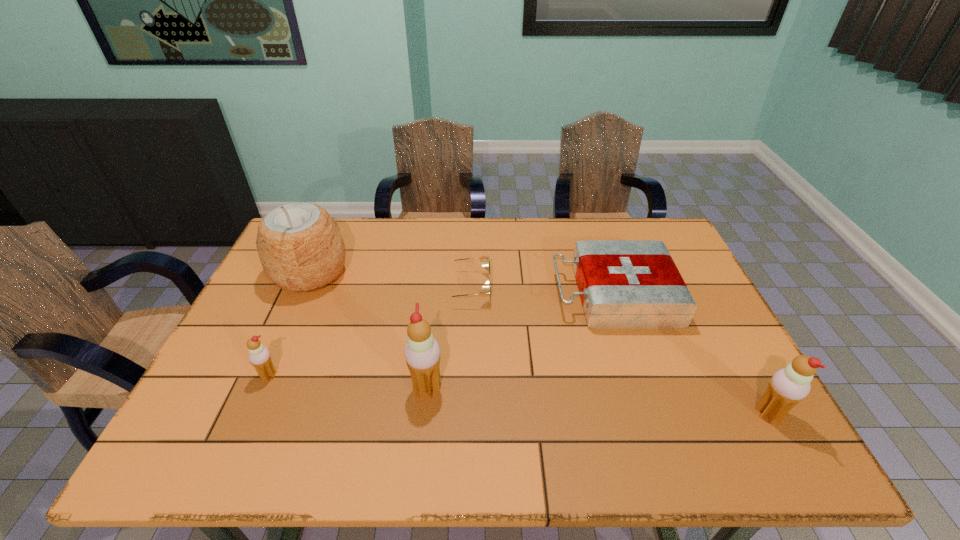
I want to click on vacant space in between the leftmost icecream and the fifth object from left to right, so click(442, 335).

Locate an element on the screen. free point between the shortest object and the second icecream from left to right is located at coordinates (446, 338).

Image resolution: width=960 pixels, height=540 pixels. Find the location of `vacant point located between the sunglasses and the second icecream from left to right`. vacant point located between the sunglasses and the second icecream from left to right is located at coordinates (446, 338).

At what (x,y) coordinates should I click in order to perform the action: click on free spot between the rightmost object and the shortest object. Please return your answer as a coordinate pair (x, y). The height and width of the screenshot is (540, 960). Looking at the image, I should click on (617, 350).

Image resolution: width=960 pixels, height=540 pixels. Find the location of `blank region between the second object from right to left and the second icecream from left to right`. blank region between the second object from right to left and the second icecream from left to right is located at coordinates (520, 341).

You are a GUI agent. You are given a task and a screenshot of the screen. Output one action in this format:
    pyautogui.click(x=<x>, y=<y>)
    Task: Click on the vacant area that lies between the tallest object and the third shortest object
    
    Given the screenshot: What is the action you would take?
    pyautogui.click(x=290, y=325)

Find the location of a particular element. Image resolution: width=960 pixels, height=540 pixels. unoccupied position between the shortest icecream and the second icecream from right to left is located at coordinates (348, 381).

Identify the location of free point between the shortest icecream and the second object from right to left. The image size is (960, 540). (442, 335).

What are the coordinates of `vacant point located between the second object from right to left and the leftmost icecream` in the screenshot? It's located at pos(442,335).

The width and height of the screenshot is (960, 540). I want to click on vacant point located between the leftmost icecream and the second icecream from left to right, so (348, 381).